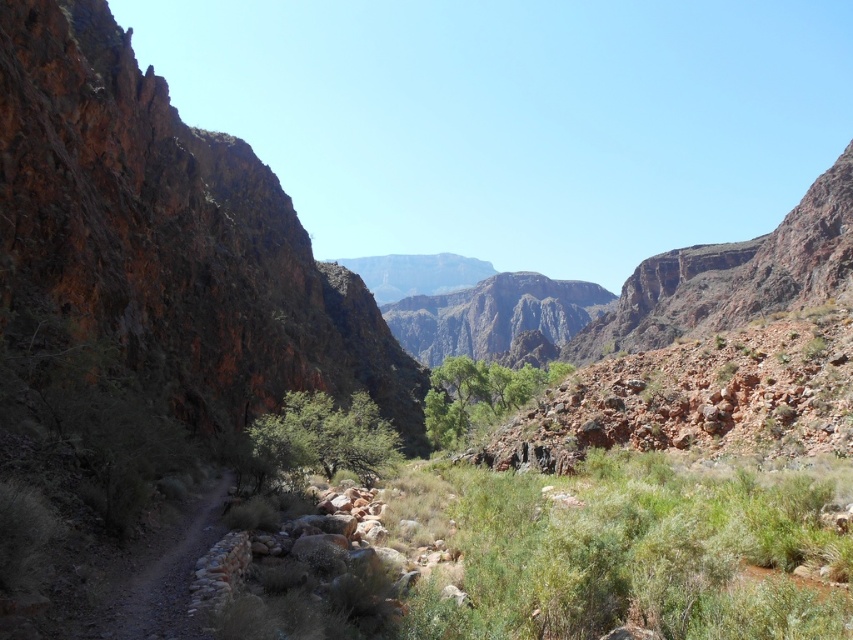
You are a hiker who wants to take a photo of the green leafy bush at center and the dirt path at left. Which object is positioned to the right side of the other?

The green leafy bush at center is positioned to the right of the dirt path at left.

You are a hiker standing on the narrow dirt path in the canyon. You notice a rusty rock cliff at left and a green leafy bush at center. Which object is higher in elevation?

The rusty rock cliff at left is positioned over the green leafy bush at center, so it is higher in elevation.